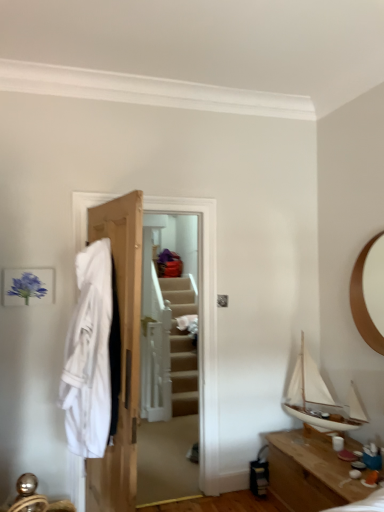
Image resolution: width=384 pixels, height=512 pixels. Describe the element at coordinates (310, 472) in the screenshot. I see `wooden table at lower right` at that location.

Locate an element on the screen. The width and height of the screenshot is (384, 512). white cotton robe at left is located at coordinates (92, 356).

Where is `wooden door at center`? wooden door at center is located at coordinates (139, 333).

Is wooden table at lower right next to white cotton robe at left and touching it?

No, wooden table at lower right is not with white cotton robe at left.

In order to click on clothing that appears above the wooden table at lower right (from a real-world perspective) in this screenshot , I will do `click(92, 356)`.

Is white cotton robe at left at the back of wooden table at lower right?

wooden table at lower right is not turned away from white cotton robe at left.

Is wooden table at lower right closer to camera compared to white cotton robe at left?

No, the depth of wooden table at lower right is greater than that of white cotton robe at left.

In the image, is wooden door at center positioned in front of or behind white matte sailboat at right?

Clearly, wooden door at center is behind white matte sailboat at right.

From a real-world perspective, is wooden door at center under white matte sailboat at right?

Incorrect, from a real-world perspective, wooden door at center is higher than white matte sailboat at right.

Between wooden door at center and white matte sailboat at right, which one has smaller width?

wooden door at center is thinner.

From the image's perspective, is wooden door at center under white matte sailboat at right?

Actually, wooden door at center appears above white matte sailboat at right in the image.

Is white matte sailboat at right far away from white cotton robe at left?

Yes, white matte sailboat at right is far from white cotton robe at left.

From the image's perspective, is white matte sailboat at right located above white cotton robe at left?

No, from the image's perspective, white matte sailboat at right is not over white cotton robe at left.

From a real-world perspective, is white matte sailboat at right located beneath white cotton robe at left?

Yes, from a real-world perspective, white matte sailboat at right is under white cotton robe at left.

Is wooden table at lower right inside wooden door at center?

No, wooden table at lower right is not a part of wooden door at center.

Identify the location of closet on the left side of wooden table at lower right. The width and height of the screenshot is (384, 512). (139, 333).

Considering the sizes of objects wooden door at center and wooden table at lower right in the image provided, who is thinner, wooden door at center or wooden table at lower right?

Thinner between the two is wooden door at center.

Considering their positions, is wooden door at center located in front of or behind wooden table at lower right?

Visually, wooden door at center is located behind wooden table at lower right.

Is wooden door at center at the left side of white cotton robe at left?

Incorrect, wooden door at center is not on the left side of white cotton robe at left.

Consider the image. Is wooden door at center aimed at white cotton robe at left?

Yes.

Who is smaller, wooden door at center or white cotton robe at left?

white cotton robe at left is smaller.

Would you say wooden table at lower right contains white matte sailboat at right?

No, white matte sailboat at right is located outside of wooden table at lower right.

Which is behind, wooden table at lower right or white matte sailboat at right?

white matte sailboat at right is behind.

From the picture: Is the surface of wooden table at lower right in direct contact with white matte sailboat at right?

There is a gap between wooden table at lower right and white matte sailboat at right.

Which of these two, wooden table at lower right or white matte sailboat at right, stands taller?

white matte sailboat at right is taller.

Is wooden table at lower right in contact with wooden door at center?

wooden table at lower right and wooden door at center are clearly separated.

Is point (316, 471) positioned before point (216, 296)?

Yes, point (316, 471) is closer to viewer.

Considering the relative positions of wooden table at lower right and wooden door at center in the image provided, is wooden table at lower right to the right of wooden door at center from the viewer's perspective?

Indeed, wooden table at lower right is positioned on the right side of wooden door at center.

From a real-world perspective, is wooden table at lower right positioned above or below wooden door at center?

In terms of real-world spatial position, wooden table at lower right is below wooden door at center.

The height and width of the screenshot is (512, 384). Find the location of `clothing above the wooden table at lower right (from the image's perspective)`. clothing above the wooden table at lower right (from the image's perspective) is located at coordinates pyautogui.click(x=92, y=356).

Where is `closet that appears behind the white matte sailboat at right`? closet that appears behind the white matte sailboat at right is located at coordinates (139, 333).

Looking at the image, which one is located closer to white matte sailboat at right, wooden table at lower right or white cotton robe at left?

wooden table at lower right is closer to white matte sailboat at right.

Considering their positions, is white matte sailboat at right positioned closer to white cotton robe at left than wooden door at center?

wooden door at center is closer to white cotton robe at left.

From the image, which object appears to be nearer to wooden door at center, white matte sailboat at right or white cotton robe at left?

white cotton robe at left is positioned closer to the anchor wooden door at center.

Looking at this image, which object lies nearer to the anchor point white matte sailboat at right, wooden door at center or white cotton robe at left?

wooden door at center is positioned closer to the anchor white matte sailboat at right.

From the image, which object appears to be farther from white cotton robe at left, wooden door at center or white matte sailboat at right?

The object further to white cotton robe at left is white matte sailboat at right.

Which object lies nearer to the anchor point white cotton robe at left, wooden door at center or wooden table at lower right?

wooden door at center is closer to white cotton robe at left.

Which object lies further to the anchor point white matte sailboat at right, wooden door at center or wooden table at lower right?

Based on the image, wooden door at center appears to be further to white matte sailboat at right.

Based on their spatial positions, is white cotton robe at left or wooden table at lower right further from white matte sailboat at right?

Based on the image, white cotton robe at left appears to be further to white matte sailboat at right.

At what (x,y) coordinates should I click in order to perform the action: click on table between white cotton robe at left and white matte sailboat at right in the horizontal direction. Please return your answer as a coordinate pair (x, y). Looking at the image, I should click on (310, 472).

Identify the location of table between wooden door at center and white matte sailboat at right from left to right. The image size is (384, 512). (310, 472).

Locate an element on the screen. closet located between white cotton robe at left and white matte sailboat at right in the left-right direction is located at coordinates 139,333.

Identify the location of closet between white cotton robe at left and wooden table at lower right. point(139,333).